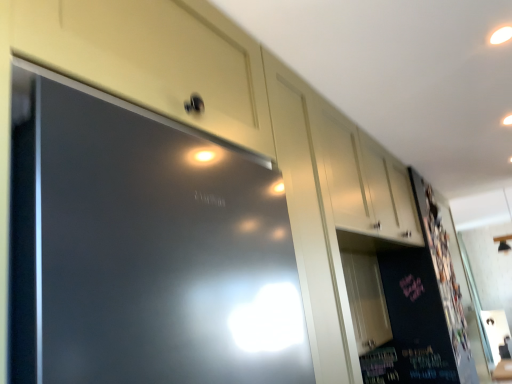
Question: In the image, is white glossy cabinet at upper center positioned in front of or behind dark matte board at right?

Choices:
 (A) front
 (B) behind

Answer: (A)

Question: In terms of height, does white glossy cabinet at upper center look taller or shorter compared to dark matte board at right?

Choices:
 (A) tall
 (B) short

Answer: (B)

Question: Based on their sizes in the image, would you say white glossy cabinet at upper center is bigger or smaller than dark matte board at right?

Choices:
 (A) big
 (B) small

Answer: (A)

Question: Considering the positions of dark matte board at right and white glossy cabinet at upper center in the image, is dark matte board at right wider or thinner than white glossy cabinet at upper center?

Choices:
 (A) thin
 (B) wide

Answer: (A)

Question: Is point (464, 349) positioned closer to the camera than point (345, 144)?

Choices:
 (A) closer
 (B) farther

Answer: (B)

Question: From a real-world perspective, is dark matte board at right above or below white glossy cabinet at upper center?

Choices:
 (A) above
 (B) below

Answer: (B)

Question: Would you say dark matte board at right is to the left or to the right of white glossy cabinet at upper center in the picture?

Choices:
 (A) right
 (B) left

Answer: (A)